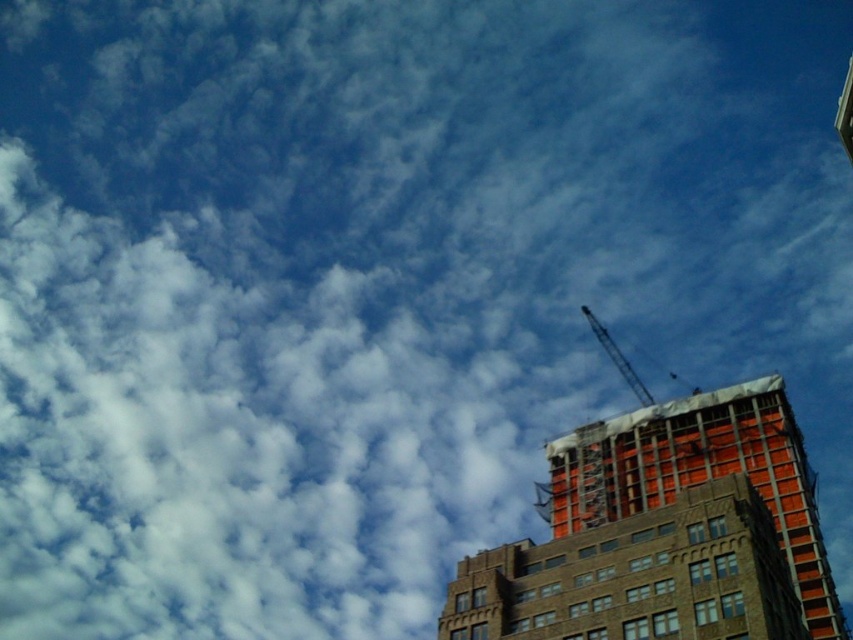
Question: Which object is farther from the camera taking this photo?

Choices:
 (A) metallic gray crane at upper right
 (B) orange brick building at upper right

Answer: (A)

Question: Among these points, which one is nearest to the camera?

Choices:
 (A) (799, 488)
 (B) (621, 368)

Answer: (A)

Question: Which of the following is the closest to the observer?

Choices:
 (A) (579, 458)
 (B) (596, 333)

Answer: (A)

Question: Does orange brick building at upper right lie behind metallic gray crane at upper right?

Choices:
 (A) no
 (B) yes

Answer: (A)

Question: Can you confirm if orange brick building at upper right is thinner than metallic gray crane at upper right?

Choices:
 (A) yes
 (B) no

Answer: (A)

Question: Can you confirm if orange brick building at upper right is positioned to the right of metallic gray crane at upper right?

Choices:
 (A) yes
 (B) no

Answer: (B)